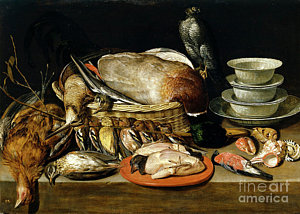
Image resolution: width=300 pixels, height=214 pixels. Find the location of `dishes`. dishes is located at coordinates (261, 69), (262, 87), (260, 107), (276, 118).